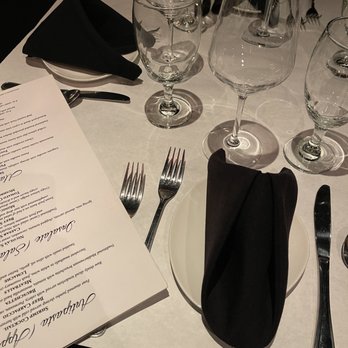
This screenshot has height=348, width=348. In order to click on black napkins in this screenshot , I will do `click(241, 233)`, `click(82, 41)`, `click(212, 2)`, `click(258, 0)`.